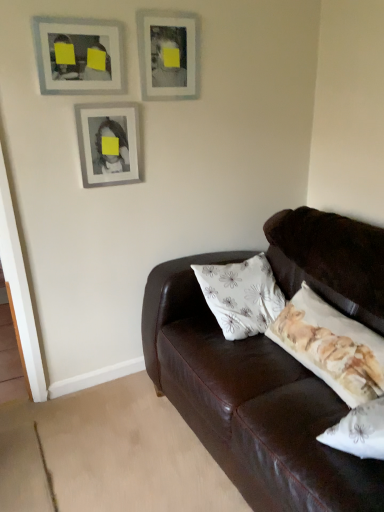
At what (x,y) coordinates should I click in order to perform the action: click on matte gray picture frame at upper left, which ranks as the 3th picture frame in right-to-left order. Please return your answer as a coordinate pair (x, y). The height and width of the screenshot is (512, 384). Looking at the image, I should click on (79, 56).

Where is `matte gray picture frame at upper left, positioned as the first picture frame in left-to-right order`? The height and width of the screenshot is (512, 384). matte gray picture frame at upper left, positioned as the first picture frame in left-to-right order is located at coordinates (79, 56).

From a real-world perspective, is matte silver picture frame at center, which is counted as the second picture frame, starting from the right, below matte gray picture frame at upper left, positioned as the first picture frame in left-to-right order?

Yes, from a real-world perspective, matte silver picture frame at center, which is counted as the second picture frame, starting from the right, is below matte gray picture frame at upper left, positioned as the first picture frame in left-to-right order.

From the image's perspective, is matte silver picture frame at center, which is counted as the second picture frame, starting from the left, located above or below matte gray picture frame at upper left, which ranks as the 3th picture frame in right-to-left order?

matte silver picture frame at center, which is counted as the second picture frame, starting from the left, is below matte gray picture frame at upper left, which ranks as the 3th picture frame in right-to-left order.

Does matte silver picture frame at center, which is counted as the second picture frame, starting from the left, appear on the left side of matte gray picture frame at upper left, positioned as the first picture frame in left-to-right order?

Incorrect, matte silver picture frame at center, which is counted as the second picture frame, starting from the left, is not on the left side of matte gray picture frame at upper left, positioned as the first picture frame in left-to-right order.

How much distance is there between matte silver picture frame at center, which is counted as the second picture frame, starting from the left, and matte gray picture frame at upper left, which ranks as the 3th picture frame in right-to-left order?

The distance of matte silver picture frame at center, which is counted as the second picture frame, starting from the left, from matte gray picture frame at upper left, which ranks as the 3th picture frame in right-to-left order, is 8.32 inches.

Could you tell me if matte silver picture frame at upper center, which is the third picture frame in left-to-right order, is facing matte silver picture frame at center, which is counted as the second picture frame, starting from the left?

No, matte silver picture frame at upper center, which is the third picture frame in left-to-right order, does not turn towards matte silver picture frame at center, which is counted as the second picture frame, starting from the left.

Consider the image. Considering the positions of objects matte silver picture frame at upper center, which is the third picture frame in left-to-right order, and matte silver picture frame at center, which is counted as the second picture frame, starting from the right, in the image provided, who is more to the left, matte silver picture frame at upper center, which is the third picture frame in left-to-right order, or matte silver picture frame at center, which is counted as the second picture frame, starting from the right,?

Positioned to the left is matte silver picture frame at center, which is counted as the second picture frame, starting from the right.

Who is taller, matte silver picture frame at upper center, which is the third picture frame in left-to-right order, or matte silver picture frame at center, which is counted as the second picture frame, starting from the left?

With more height is matte silver picture frame at center, which is counted as the second picture frame, starting from the left.

Is matte silver picture frame at upper center, which is the 1th picture frame from right to left, positioned far away from matte silver picture frame at center, which is counted as the second picture frame, starting from the right?

No, matte silver picture frame at upper center, which is the 1th picture frame from right to left, is not far away from matte silver picture frame at center, which is counted as the second picture frame, starting from the right.

Is matte gray picture frame at upper left, positioned as the first picture frame in left-to-right order, a part of matte silver picture frame at upper center, which is the 1th picture frame from right to left?

Definitely not — matte gray picture frame at upper left, positioned as the first picture frame in left-to-right order, is not inside matte silver picture frame at upper center, which is the 1th picture frame from right to left.

In the scene shown: From the image's perspective, which one is positioned higher, matte silver picture frame at upper center, which is the 1th picture frame from right to left, or matte gray picture frame at upper left, positioned as the first picture frame in left-to-right order?

matte silver picture frame at upper center, which is the 1th picture frame from right to left.

From a real-world perspective, is matte silver picture frame at upper center, which is the third picture frame in left-to-right order, positioned above or below matte gray picture frame at upper left, which ranks as the 3th picture frame in right-to-left order?

matte silver picture frame at upper center, which is the third picture frame in left-to-right order, is situated higher than matte gray picture frame at upper left, which ranks as the 3th picture frame in right-to-left order, in the real world.

Is matte silver picture frame at upper center, which is the third picture frame in left-to-right order, looking in the opposite direction of matte gray picture frame at upper left, which ranks as the 3th picture frame in right-to-left order?

matte silver picture frame at upper center, which is the third picture frame in left-to-right order, does not have its back to matte gray picture frame at upper left, which ranks as the 3th picture frame in right-to-left order.

Is matte silver picture frame at center, which is counted as the second picture frame, starting from the left, not close to matte silver picture frame at upper center, which is the 1th picture frame from right to left?

No, there isn't a large distance between matte silver picture frame at center, which is counted as the second picture frame, starting from the left, and matte silver picture frame at upper center, which is the 1th picture frame from right to left.

From the picture: From the image's perspective, which is above, matte silver picture frame at center, which is counted as the second picture frame, starting from the right, or matte silver picture frame at upper center, which is the 1th picture frame from right to left?

matte silver picture frame at upper center, which is the 1th picture frame from right to left, appears higher in the image.

Is matte silver picture frame at upper center, which is the 1th picture frame from right to left, completely or partially inside matte silver picture frame at center, which is counted as the second picture frame, starting from the left?

That's incorrect, matte silver picture frame at upper center, which is the 1th picture frame from right to left, is not inside matte silver picture frame at center, which is counted as the second picture frame, starting from the left.

Could you tell me if matte silver picture frame at center, which is counted as the second picture frame, starting from the right, is turned towards matte silver picture frame at upper center, which is the 1th picture frame from right to left?

No, matte silver picture frame at center, which is counted as the second picture frame, starting from the right, is not facing towards matte silver picture frame at upper center, which is the 1th picture frame from right to left.

Can you confirm if matte gray picture frame at upper left, which ranks as the 3th picture frame in right-to-left order, is shorter than matte silver picture frame at center, which is counted as the second picture frame, starting from the right?

Correct, matte gray picture frame at upper left, which ranks as the 3th picture frame in right-to-left order, is not as tall as matte silver picture frame at center, which is counted as the second picture frame, starting from the right.

From the image's perspective, which one is positioned higher, matte gray picture frame at upper left, positioned as the first picture frame in left-to-right order, or matte silver picture frame at center, which is counted as the second picture frame, starting from the left?

From the image's view, matte gray picture frame at upper left, positioned as the first picture frame in left-to-right order, is above.

From a real-world perspective, is matte gray picture frame at upper left, positioned as the first picture frame in left-to-right order, on top of matte silver picture frame at center, which is counted as the second picture frame, starting from the right?

Indeed, from a real-world perspective, matte gray picture frame at upper left, positioned as the first picture frame in left-to-right order, stands above matte silver picture frame at center, which is counted as the second picture frame, starting from the right.

Is matte gray picture frame at upper left, which ranks as the 3th picture frame in right-to-left order, beside matte silver picture frame at center, which is counted as the second picture frame, starting from the left?

matte gray picture frame at upper left, which ranks as the 3th picture frame in right-to-left order, and matte silver picture frame at center, which is counted as the second picture frame, starting from the left, are not in contact.

Is the position of matte gray picture frame at upper left, positioned as the first picture frame in left-to-right order, more distant than that of matte silver picture frame at upper center, which is the third picture frame in left-to-right order?

No.

Considering the relative sizes of matte gray picture frame at upper left, which ranks as the 3th picture frame in right-to-left order, and matte silver picture frame at upper center, which is the 1th picture frame from right to left, in the image provided, is matte gray picture frame at upper left, which ranks as the 3th picture frame in right-to-left order, bigger than matte silver picture frame at upper center, which is the 1th picture frame from right to left,?

No.

Considering the relative positions of matte gray picture frame at upper left, positioned as the first picture frame in left-to-right order, and matte silver picture frame at upper center, which is the 1th picture frame from right to left, in the image provided, is matte gray picture frame at upper left, positioned as the first picture frame in left-to-right order, to the left or to the right of matte silver picture frame at upper center, which is the 1th picture frame from right to left,?

Based on their positions, matte gray picture frame at upper left, positioned as the first picture frame in left-to-right order, is located to the left of matte silver picture frame at upper center, which is the 1th picture frame from right to left.

The width and height of the screenshot is (384, 512). In the image, there is a matte gray picture frame at upper left, positioned as the first picture frame in left-to-right order. Identify the location of picture frame below it (from a real-world perspective). (109, 143).

From the image's perspective, which picture frame is the 2nd one below the matte silver picture frame at upper center, which is the third picture frame in left-to-right order? Please provide its 2D coordinates.

[(109, 143)]

Considering their positions, is matte silver picture frame at upper center, which is the third picture frame in left-to-right order, positioned further to matte gray picture frame at upper left, which ranks as the 3th picture frame in right-to-left order, than matte silver picture frame at center, which is counted as the second picture frame, starting from the left?

matte silver picture frame at upper center, which is the third picture frame in left-to-right order, is further to matte gray picture frame at upper left, which ranks as the 3th picture frame in right-to-left order.

Which object lies nearer to the anchor point matte silver picture frame at upper center, which is the third picture frame in left-to-right order, matte gray picture frame at upper left, which ranks as the 3th picture frame in right-to-left order, or matte silver picture frame at center, which is counted as the second picture frame, starting from the right?

Based on the image, matte gray picture frame at upper left, which ranks as the 3th picture frame in right-to-left order, appears to be nearer to matte silver picture frame at upper center, which is the third picture frame in left-to-right order.

Based on their spatial positions, is matte silver picture frame at center, which is counted as the second picture frame, starting from the right, or matte silver picture frame at upper center, which is the third picture frame in left-to-right order, further from matte gray picture frame at upper left, positioned as the first picture frame in left-to-right order?

Based on the image, matte silver picture frame at upper center, which is the third picture frame in left-to-right order, appears to be further to matte gray picture frame at upper left, positioned as the first picture frame in left-to-right order.

When comparing their distances from matte silver picture frame at center, which is counted as the second picture frame, starting from the left, does matte silver picture frame at upper center, which is the third picture frame in left-to-right order, or matte gray picture frame at upper left, positioned as the first picture frame in left-to-right order, seem closer?

matte gray picture frame at upper left, positioned as the first picture frame in left-to-right order, lies closer to matte silver picture frame at center, which is counted as the second picture frame, starting from the left, than the other object.

When comparing their distances from matte silver picture frame at upper center, which is the third picture frame in left-to-right order, does matte silver picture frame at center, which is counted as the second picture frame, starting from the left, or matte gray picture frame at upper left, positioned as the first picture frame in left-to-right order, seem further?

matte silver picture frame at center, which is counted as the second picture frame, starting from the left, is positioned further to the anchor matte silver picture frame at upper center, which is the third picture frame in left-to-right order.

Considering their positions, is matte gray picture frame at upper left, positioned as the first picture frame in left-to-right order, positioned closer to matte silver picture frame at center, which is counted as the second picture frame, starting from the right, than matte silver picture frame at upper center, which is the third picture frame in left-to-right order?

matte gray picture frame at upper left, positioned as the first picture frame in left-to-right order, lies closer to matte silver picture frame at center, which is counted as the second picture frame, starting from the right, than the other object.

Locate an element on the screen. This screenshot has width=384, height=512. picture frame between matte silver picture frame at upper center, which is the 1th picture frame from right to left, and matte silver picture frame at center, which is counted as the second picture frame, starting from the right, in the vertical direction is located at coordinates (79, 56).